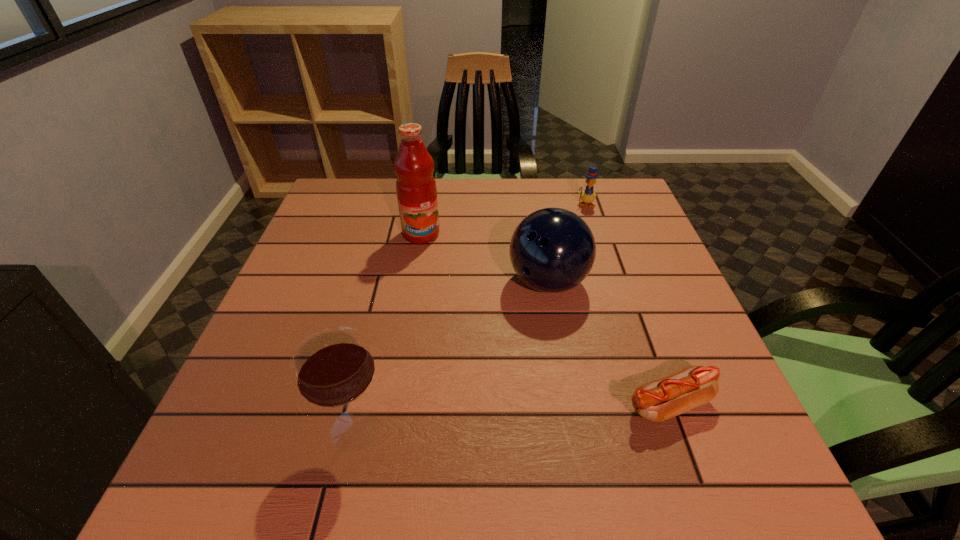
The width and height of the screenshot is (960, 540). Identify the location of wineglass. (333, 367).

Image resolution: width=960 pixels, height=540 pixels. What are the coordinates of `the shortest object` in the screenshot? It's located at (659, 400).

You are a GUI agent. You are given a task and a screenshot of the screen. Output one action in this format:
    pyautogui.click(x=<x>, y=<y>)
    Task: Click on the third object from left to right
    
    Given the screenshot: What is the action you would take?
    pyautogui.click(x=552, y=250)

Locate an element on the screen. This screenshot has height=540, width=960. the third nearest object is located at coordinates (552, 250).

You are a GUI agent. You are given a task and a screenshot of the screen. Output one action in this format:
    pyautogui.click(x=<x>, y=<y>)
    Task: Click on the tallest object
    This screenshot has height=540, width=960.
    Given the screenshot: What is the action you would take?
    pyautogui.click(x=416, y=189)

Image resolution: width=960 pixels, height=540 pixels. In order to click on the second farthest object in this screenshot , I will do `click(416, 189)`.

Where is `the farthest object`? the farthest object is located at coordinates (588, 196).

Where is `duckling`? Image resolution: width=960 pixels, height=540 pixels. duckling is located at coordinates 588,196.

I want to click on vacant space situated 0.050m on the right of the wineglass, so click(x=418, y=429).

At what (x,y) coordinates should I click in order to perform the action: click on free space located on the back of the sausage. Please return your answer as a coordinate pair (x, y). This screenshot has height=540, width=960. Looking at the image, I should click on (632, 305).